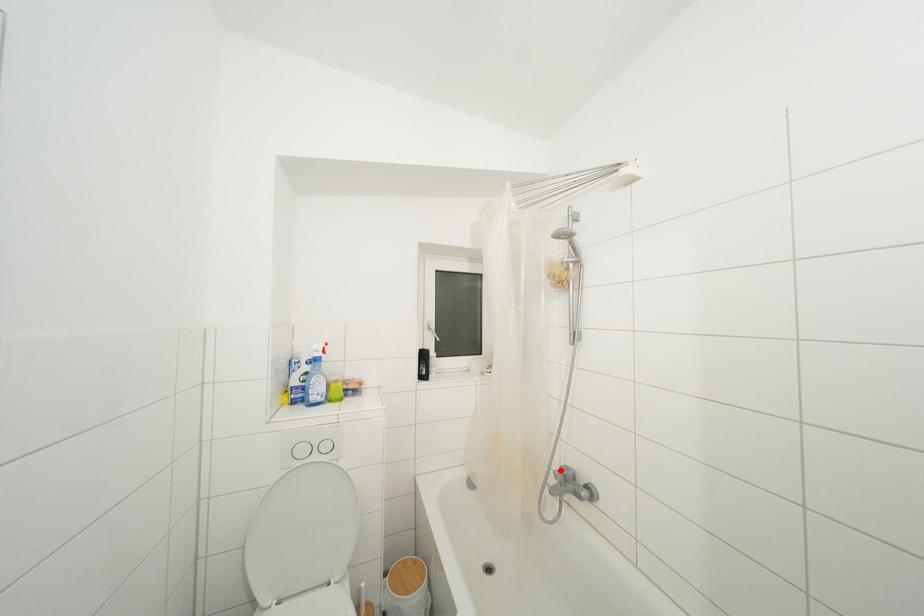
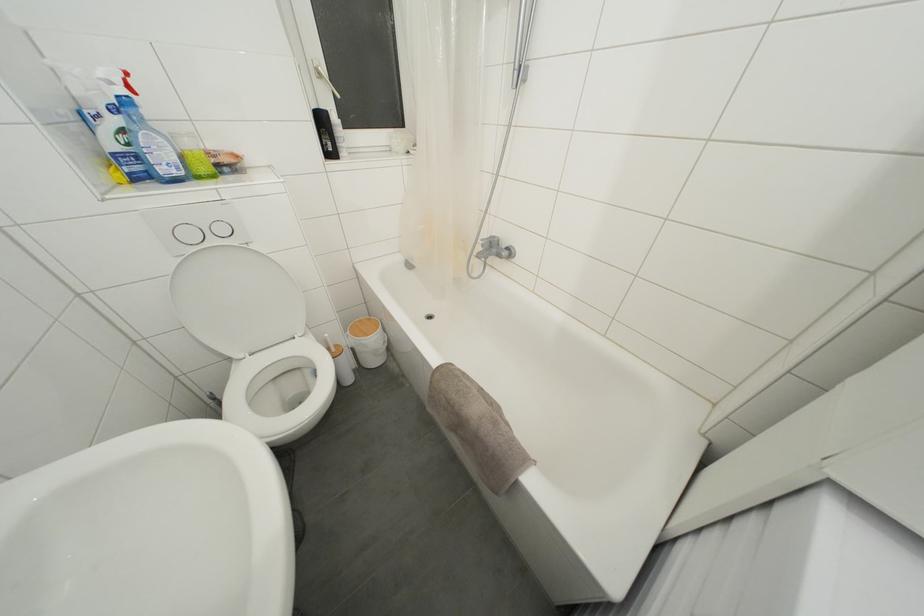
Question: I am providing you with two images of the same scene from different viewpoints. In image1, a red point is highlighted. Considering the same 3D point in image2, which of the following is correct?

Choices:
 (A) It is closer
 (B) It is farther

Answer: (A)